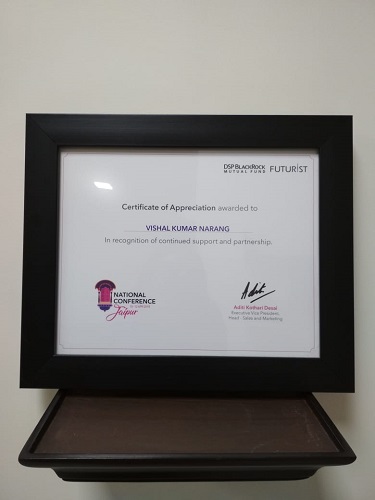
Find the location of `reflection if light in picture frame`. reflection if light in picture frame is located at coordinates (106, 187).